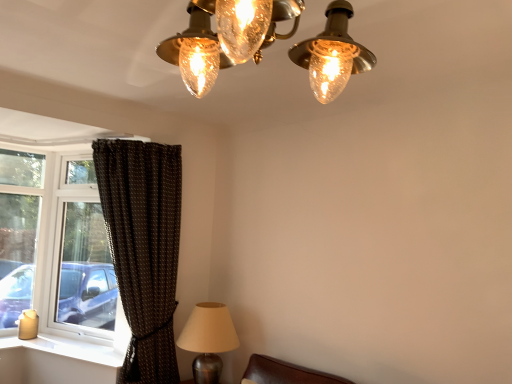
Question: Is metallic silver lamp at lower left bigger or smaller than brown textured curtain at left?

Choices:
 (A) big
 (B) small

Answer: (B)

Question: Considering the positions of point (195, 329) and point (173, 210), is point (195, 329) closer or farther from the camera than point (173, 210)?

Choices:
 (A) closer
 (B) farther

Answer: (A)

Question: Which object is the farthest from the metallic silver lamp at lower left?

Choices:
 (A) clear glass window at left
 (B) brown textured curtain at left
 (C) white plastic window sill at lower left

Answer: (A)

Question: Which object is positioned closest to the white plastic window sill at lower left?

Choices:
 (A) clear glass window at left
 (B) brown textured curtain at left
 (C) metallic silver lamp at lower left

Answer: (A)